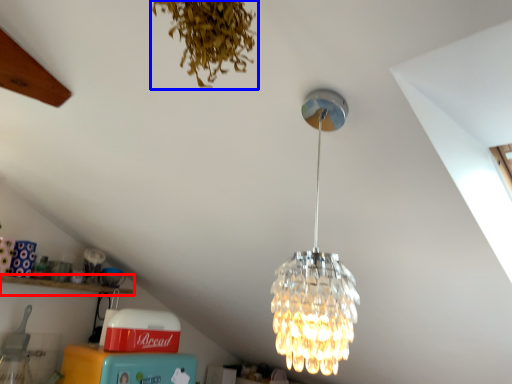
Question: Which object appears closest to the camera in this image, shelf (highlighted by a red box) or plant (highlighted by a blue box)?

Choices:
 (A) shelf
 (B) plant

Answer: (B)